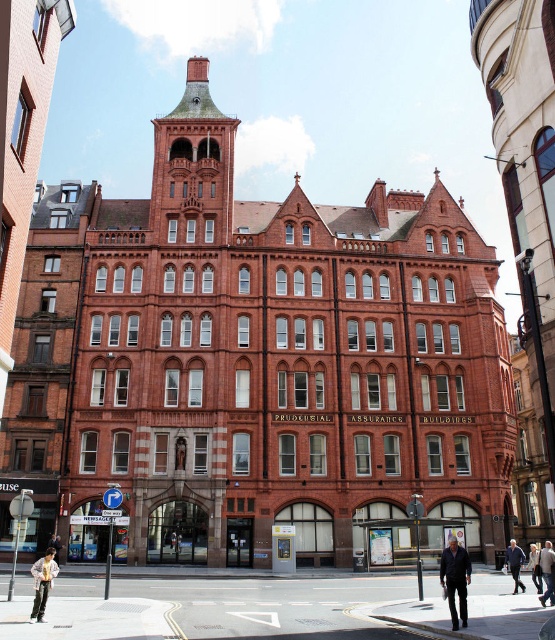
Question: Is light beige fabric coat at lower right bigger than light brown leather jacket at lower left?

Choices:
 (A) yes
 (B) no

Answer: (A)

Question: Is dark blue jeans at lower center to the left of light beige fabric jacket at lower right from the viewer's perspective?

Choices:
 (A) no
 (B) yes

Answer: (B)

Question: Which object is the closest to the light beige fabric coat at lower right?

Choices:
 (A) light beige fabric jacket at lower right
 (B) blue denim jacket at lower right
 (C) light brown leather pants at lower left
 (D) dark blue jeans at lower center

Answer: (A)

Question: Which of these objects is positioned farthest from the light brown leather pants at lower left?

Choices:
 (A) blue denim jacket at lower right
 (B) light brown leather jacket at lower left

Answer: (A)

Question: In this image, where is light brown leather pants at lower left located relative to light brown leather jacket at lower left?

Choices:
 (A) right
 (B) left

Answer: (A)

Question: Which object is the closest to the light brown leather pants at lower left?

Choices:
 (A) blue denim jacket at lower right
 (B) light brown leather jacket at lower left

Answer: (B)